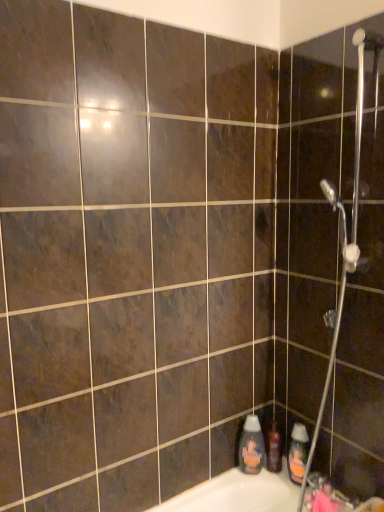
Question: Considering their positions, is metallic silver faucet at lower right located in front of or behind orange matte bottle at lower right, the second cleaning product in the left-to-right sequence?

Choices:
 (A) front
 (B) behind

Answer: (A)

Question: From their relative heights in the image, would you say metallic silver faucet at lower right is taller or shorter than orange matte bottle at lower right, the second cleaning product in the left-to-right sequence?

Choices:
 (A) tall
 (B) short

Answer: (B)

Question: Which object is the farthest from the metallic silver shower head at upper right?

Choices:
 (A) metallic silver faucet at lower right
 (B) orange matte bottle at lower right, placed as the first cleaning product when sorted from right to left
 (C) translucent plastic bottle at lower right, the second cleaning product viewed from the right
 (D) translucent plastic shampoo bottle at lower right

Answer: (D)

Question: Which is farther from the translucent plastic shampoo bottle at lower right?

Choices:
 (A) orange matte bottle at lower right, the second cleaning product in the left-to-right sequence
 (B) metallic silver faucet at lower right
 (C) translucent plastic bottle at lower right, which is the 1th cleaning product in left-to-right order
 (D) metallic silver shower head at upper right

Answer: (D)